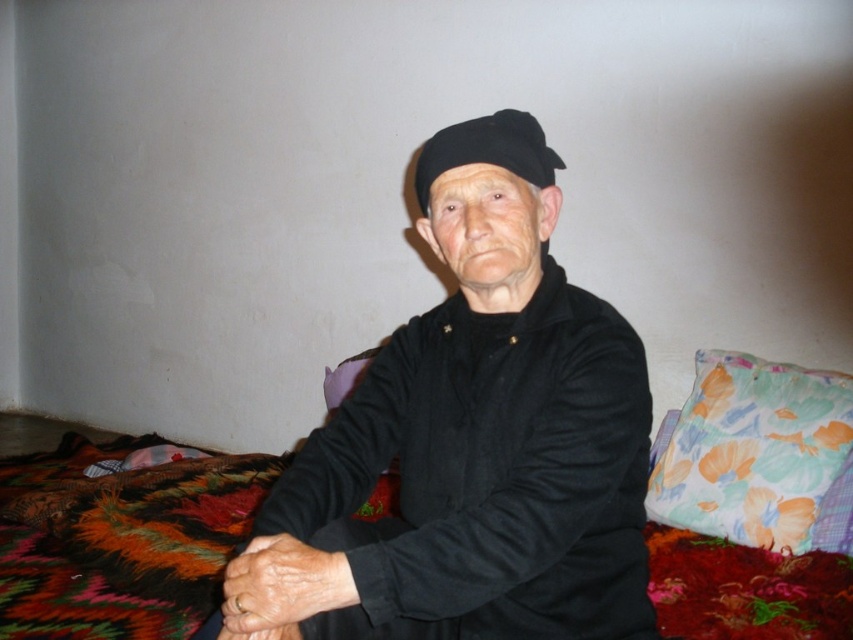
Which of these two, floral fabric bed at center or floral fabric pillow at lower right, stands shorter?

floral fabric bed at center is shorter.

Is floral fabric bed at center shorter than floral fabric pillow at lower right?

Correct, floral fabric bed at center is not as tall as floral fabric pillow at lower right.

Between point (724, 545) and point (711, 499), which one is positioned in front?

Point (724, 545)

Find the location of a particular element. This screenshot has height=640, width=853. floral fabric bed at center is located at coordinates (119, 540).

Which is below, floral fabric pillow at lower right or black fabric hat at center?

floral fabric pillow at lower right is below.

Based on the photo, does floral fabric pillow at lower right have a lesser height compared to black fabric hat at center?

Incorrect, floral fabric pillow at lower right's height does not fall short of black fabric hat at center's.

Does point (810, 460) come in front of point (532, 144)?

No, (810, 460) is behind (532, 144).

The height and width of the screenshot is (640, 853). I want to click on floral fabric pillow at lower right, so pos(757,456).

Who is more forward, (505, 173) or (535, 132)?

Point (505, 173)

Between black matte jacket at center and black fabric hat at center, which one is positioned higher?

black fabric hat at center is higher up.

Between point (262, 572) and point (525, 173), which one is positioned behind?

Point (525, 173)

Find the location of a particular element. The image size is (853, 640). black matte jacket at center is located at coordinates (473, 442).